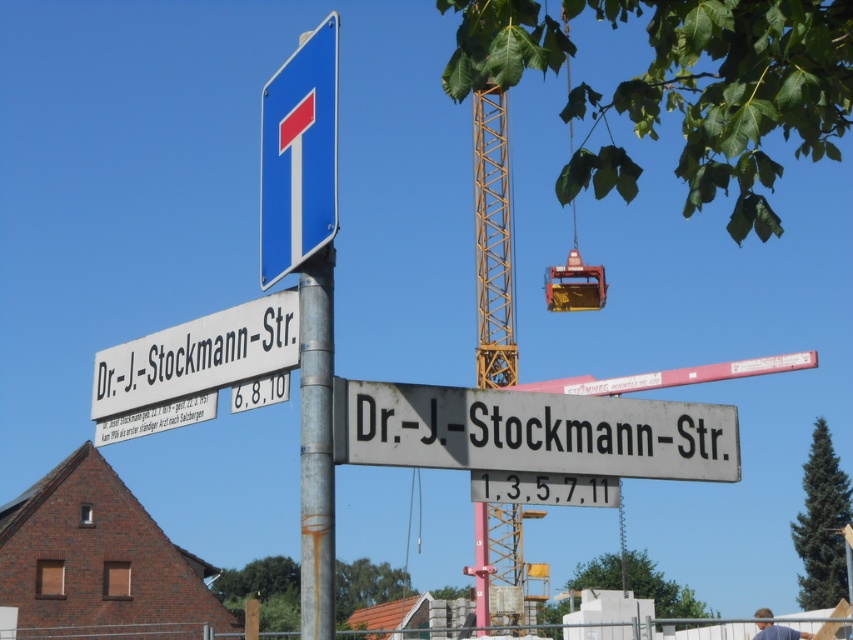
Question: Among these objects, which one is farthest from the camera?

Choices:
 (A) white plastic street sign at upper left
 (B) rusty metal pole at center
 (C) white matte street sign at center
 (D) blue plastic sign at upper center

Answer: (A)

Question: Is white matte street sign at center to the left of blue plastic sign at upper center from the viewer's perspective?

Choices:
 (A) yes
 (B) no

Answer: (B)

Question: Is blue plastic sign at upper center thinner than white plastic street sign at upper left?

Choices:
 (A) no
 (B) yes

Answer: (A)

Question: Is blue plastic sign at upper center in front of rusty metal pole at center?

Choices:
 (A) no
 (B) yes

Answer: (A)

Question: Which of the following is the closest to the observer?

Choices:
 (A) (318, 392)
 (B) (277, 221)
 (C) (126, 401)

Answer: (A)

Question: Which point is closer to the camera?

Choices:
 (A) (334, 180)
 (B) (102, 356)
 (C) (299, 305)

Answer: (A)